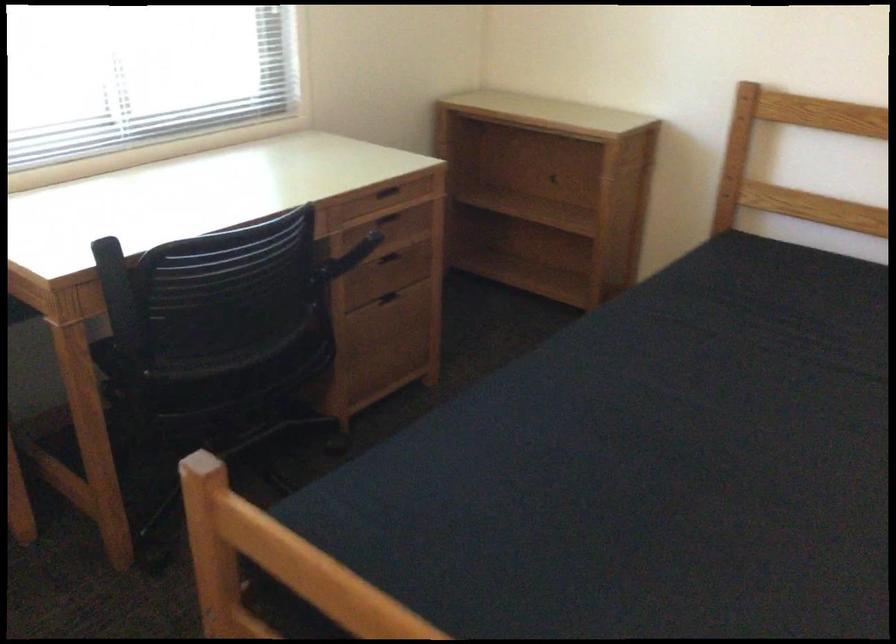
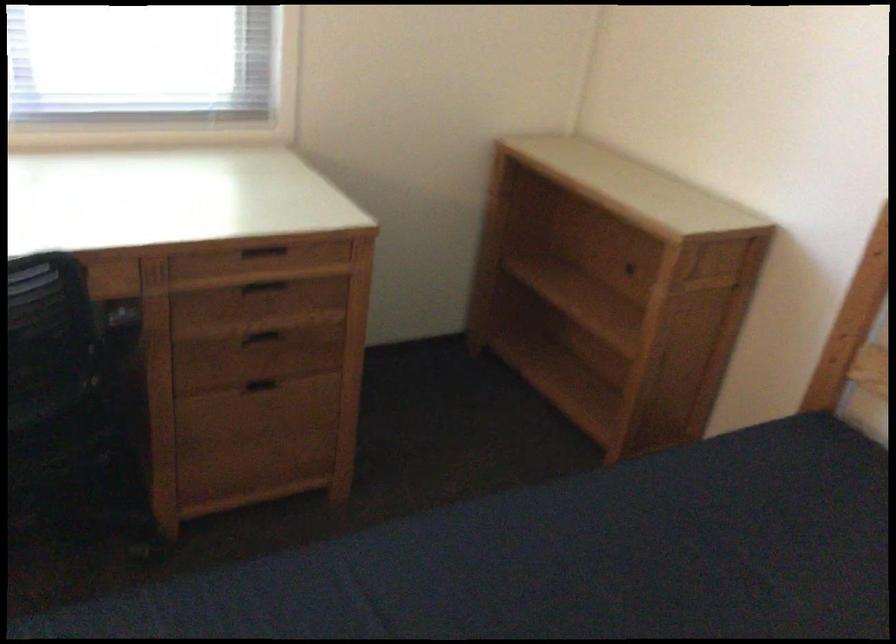
Locate, in the second image, the point that corresponds to pixel 391 297 in the first image.

(261, 384)